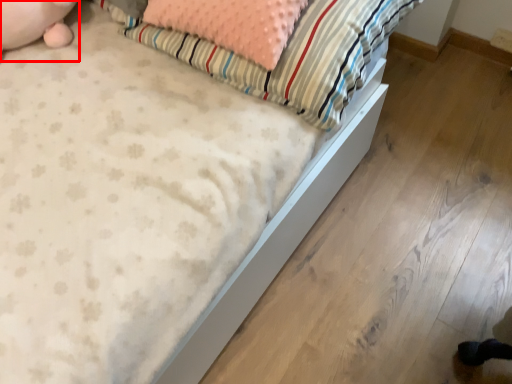
Question: In this image, where is animal (annotated by the red box) located relative to pillow?

Choices:
 (A) right
 (B) left

Answer: (B)